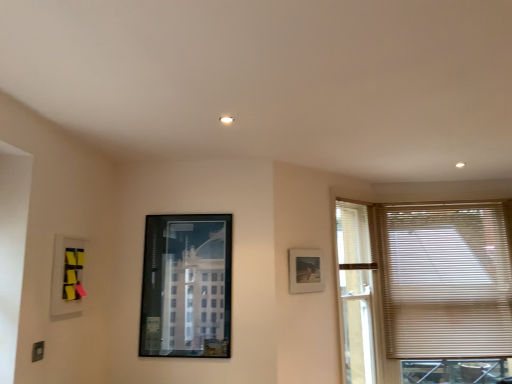
You are a GUI agent. You are given a task and a screenshot of the screen. Output one action in this format:
    pyautogui.click(x=<x>, y=<y>)
    Task: Click on the matte black picture frame at upper right, which is the third picture frame from left to right
    
    Given the screenshot: What is the action you would take?
    pyautogui.click(x=305, y=271)

Measure the distance between metallic glass picture frame at center, the second picture frame viewed from the front, and camera.

metallic glass picture frame at center, the second picture frame viewed from the front, and camera are 2.71 meters apart from each other.

Locate an element on the screen. The width and height of the screenshot is (512, 384). matte plastic picture frame at upper left, the 1th picture frame from the left is located at coordinates (67, 275).

Considering the sizes of objects metallic glass picture frame at center, the second picture frame viewed from the front, and matte plastic picture frame at upper left, the 3th picture frame in the back-to-front sequence, in the image provided, who is shorter, metallic glass picture frame at center, the second picture frame viewed from the front, or matte plastic picture frame at upper left, the 3th picture frame in the back-to-front sequence,?

With less height is matte plastic picture frame at upper left, the 3th picture frame in the back-to-front sequence.

Can you confirm if metallic glass picture frame at center, which is counted as the second picture frame, starting from the right, is wider than matte plastic picture frame at upper left, the 1th picture frame from the left?

In fact, metallic glass picture frame at center, which is counted as the second picture frame, starting from the right, might be narrower than matte plastic picture frame at upper left, the 1th picture frame from the left.

Could you measure the distance between metallic glass picture frame at center, acting as the 2th picture frame starting from the back, and matte plastic picture frame at upper left, the 3th picture frame in the back-to-front sequence?

metallic glass picture frame at center, acting as the 2th picture frame starting from the back, is 24.91 inches from matte plastic picture frame at upper left, the 3th picture frame in the back-to-front sequence.

Starting from the beige blinds at right, which picture frame is the 1st one in front? Please provide its 2D coordinates.

[(305, 271)]

From a real-world perspective, between beige blinds at right and matte black picture frame at upper right, marked as the 3th picture frame in a front-to-back arrangement, who is vertically higher?

In real-world perspective, matte black picture frame at upper right, marked as the 3th picture frame in a front-to-back arrangement, is above.

In terms of size, does beige blinds at right appear bigger or smaller than matte black picture frame at upper right, the first picture frame from the back?

Considering their sizes, beige blinds at right takes up more space than matte black picture frame at upper right, the first picture frame from the back.

Which is more to the left, beige blinds at right or metallic glass picture frame at center, the second picture frame viewed from the front?

metallic glass picture frame at center, the second picture frame viewed from the front, is more to the left.

Is beige blinds at right next to metallic glass picture frame at center, positioned as the 2th picture frame in left-to-right order?

No, beige blinds at right is not making contact with metallic glass picture frame at center, positioned as the 2th picture frame in left-to-right order.

From a real-world perspective, count 1st picture frames upward from the beige blinds at right and point to it. Please provide its 2D coordinates.

[(186, 286)]

Is matte plastic picture frame at upper left, positioned as the 1th picture frame in front-to-back order, bigger than beige blinds at right?

No.

Locate an element on the screen. The width and height of the screenshot is (512, 384). window behind the matte plastic picture frame at upper left, which ranks as the third picture frame in right-to-left order is located at coordinates (421, 285).

Is matte plastic picture frame at upper left, which ranks as the third picture frame in right-to-left order, turned away from beige blinds at right?

No, matte plastic picture frame at upper left, which ranks as the third picture frame in right-to-left order, is not facing away from beige blinds at right.

Can you confirm if matte plastic picture frame at upper left, the 3th picture frame in the back-to-front sequence, is positioned to the right of beige blinds at right?

In fact, matte plastic picture frame at upper left, the 3th picture frame in the back-to-front sequence, is to the left of beige blinds at right.

Considering the sizes of objects beige blinds at right and matte plastic picture frame at upper left, the 3th picture frame in the back-to-front sequence, in the image provided, who is shorter, beige blinds at right or matte plastic picture frame at upper left, the 3th picture frame in the back-to-front sequence,?

matte plastic picture frame at upper left, the 3th picture frame in the back-to-front sequence, is shorter.

From the image's perspective, which one is positioned lower, beige blinds at right or matte plastic picture frame at upper left, which ranks as the third picture frame in right-to-left order?

From the image's view, beige blinds at right is below.

Which object is closer to the camera taking this photo, beige blinds at right or matte plastic picture frame at upper left, which ranks as the third picture frame in right-to-left order?

matte plastic picture frame at upper left, which ranks as the third picture frame in right-to-left order, is in front.

How many degrees apart are the facing directions of beige blinds at right and matte plastic picture frame at upper left, which ranks as the third picture frame in right-to-left order?

The facing directions of beige blinds at right and matte plastic picture frame at upper left, which ranks as the third picture frame in right-to-left order, are 90.8 degrees apart.

From a real-world perspective, is matte black picture frame at upper right, which is the third picture frame from left to right, located beneath beige blinds at right?

No.

How many degrees apart are the facing directions of matte black picture frame at upper right, marked as the 3th picture frame in a front-to-back arrangement, and beige blinds at right?

matte black picture frame at upper right, marked as the 3th picture frame in a front-to-back arrangement, and beige blinds at right are facing 51 degrees away from each other.

Between matte black picture frame at upper right, which is the third picture frame from left to right, and beige blinds at right, which one has less height?

matte black picture frame at upper right, which is the third picture frame from left to right, is shorter.

Which of these two, matte black picture frame at upper right, which ranks as the first picture frame in right-to-left order, or beige blinds at right, is wider?

beige blinds at right is wider.

Which point is more forward, (61, 241) or (174, 314)?

The point (61, 241) is in front.

Where is `picture frame below the matte plastic picture frame at upper left, which ranks as the third picture frame in right-to-left order (from a real-world perspective)`? The width and height of the screenshot is (512, 384). picture frame below the matte plastic picture frame at upper left, which ranks as the third picture frame in right-to-left order (from a real-world perspective) is located at coordinates (186, 286).

Is matte plastic picture frame at upper left, which ranks as the third picture frame in right-to-left order, turned away from metallic glass picture frame at center, acting as the 2th picture frame starting from the back?

No.

From a real-world perspective, which is physically below, matte plastic picture frame at upper left, which ranks as the third picture frame in right-to-left order, or metallic glass picture frame at center, acting as the 2th picture frame starting from the back?

metallic glass picture frame at center, acting as the 2th picture frame starting from the back, is physically lower.

What are the coordinates of `picture frame directly beneath the matte plastic picture frame at upper left, the 1th picture frame from the left (from a real-world perspective)` in the screenshot? It's located at (186, 286).

Find the location of a particular element. The height and width of the screenshot is (384, 512). the 1st picture frame to the left of the beige blinds at right, counting from the anchor's position is located at coordinates (305, 271).

Estimate the real-world distances between objects in this image. Which object is further from matte plastic picture frame at upper left, positioned as the 1th picture frame in front-to-back order, beige blinds at right or matte black picture frame at upper right, marked as the 3th picture frame in a front-to-back arrangement?

Based on the image, beige blinds at right appears to be further to matte plastic picture frame at upper left, positioned as the 1th picture frame in front-to-back order.

Considering their positions, is metallic glass picture frame at center, positioned as the 2th picture frame in left-to-right order, positioned further to beige blinds at right than matte plastic picture frame at upper left, which ranks as the third picture frame in right-to-left order?

matte plastic picture frame at upper left, which ranks as the third picture frame in right-to-left order, is positioned further to the anchor beige blinds at right.

Looking at the image, which one is located closer to matte plastic picture frame at upper left, positioned as the 1th picture frame in front-to-back order, matte black picture frame at upper right, which ranks as the first picture frame in right-to-left order, or beige blinds at right?

matte black picture frame at upper right, which ranks as the first picture frame in right-to-left order, lies closer to matte plastic picture frame at upper left, positioned as the 1th picture frame in front-to-back order, than the other object.

Which object lies nearer to the anchor point matte black picture frame at upper right, which ranks as the first picture frame in right-to-left order, matte plastic picture frame at upper left, the 1th picture frame from the left, or metallic glass picture frame at center, acting as the 2th picture frame starting from the back?

metallic glass picture frame at center, acting as the 2th picture frame starting from the back, is positioned closer to the anchor matte black picture frame at upper right, which ranks as the first picture frame in right-to-left order.

Based on their spatial positions, is matte black picture frame at upper right, marked as the 3th picture frame in a front-to-back arrangement, or metallic glass picture frame at center, acting as the 2th picture frame starting from the back, further from beige blinds at right?

metallic glass picture frame at center, acting as the 2th picture frame starting from the back.

Which object lies further to the anchor point metallic glass picture frame at center, the second picture frame viewed from the front, matte black picture frame at upper right, the first picture frame from the back, or matte plastic picture frame at upper left, the 3th picture frame in the back-to-front sequence?

matte black picture frame at upper right, the first picture frame from the back.

When comparing their distances from matte plastic picture frame at upper left, which ranks as the third picture frame in right-to-left order, does metallic glass picture frame at center, which is counted as the second picture frame, starting from the right, or matte black picture frame at upper right, which is the third picture frame from left to right, seem closer?

metallic glass picture frame at center, which is counted as the second picture frame, starting from the right.

Which object lies further to the anchor point matte black picture frame at upper right, the first picture frame from the back, matte plastic picture frame at upper left, positioned as the 1th picture frame in front-to-back order, or beige blinds at right?

matte plastic picture frame at upper left, positioned as the 1th picture frame in front-to-back order, is further to matte black picture frame at upper right, the first picture frame from the back.

You are a GUI agent. You are given a task and a screenshot of the screen. Output one action in this format:
    pyautogui.click(x=<x>, y=<y>)
    Task: Click on the picture frame between matte plastic picture frame at upper left, the 1th picture frame from the left, and matte black picture frame at upper right, the first picture frame from the back, in the horizontal direction
    The height and width of the screenshot is (384, 512).
    Given the screenshot: What is the action you would take?
    pyautogui.click(x=186, y=286)

Locate an element on the screen. The height and width of the screenshot is (384, 512). picture frame located between metallic glass picture frame at center, the second picture frame viewed from the front, and beige blinds at right in the left-right direction is located at coordinates (305, 271).